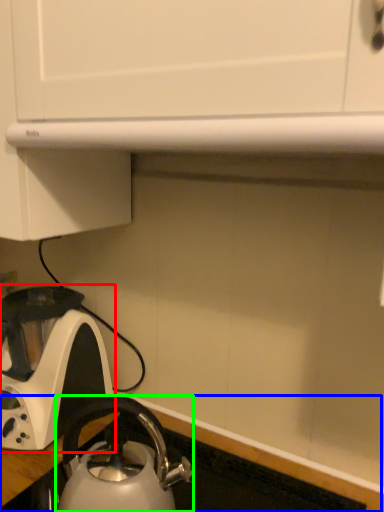
Question: Which is nearer to the kettle (highlighted by a red box)? counter top (highlighted by a blue box) or kettle (highlighted by a green box).

Choices:
 (A) counter top
 (B) kettle

Answer: (B)